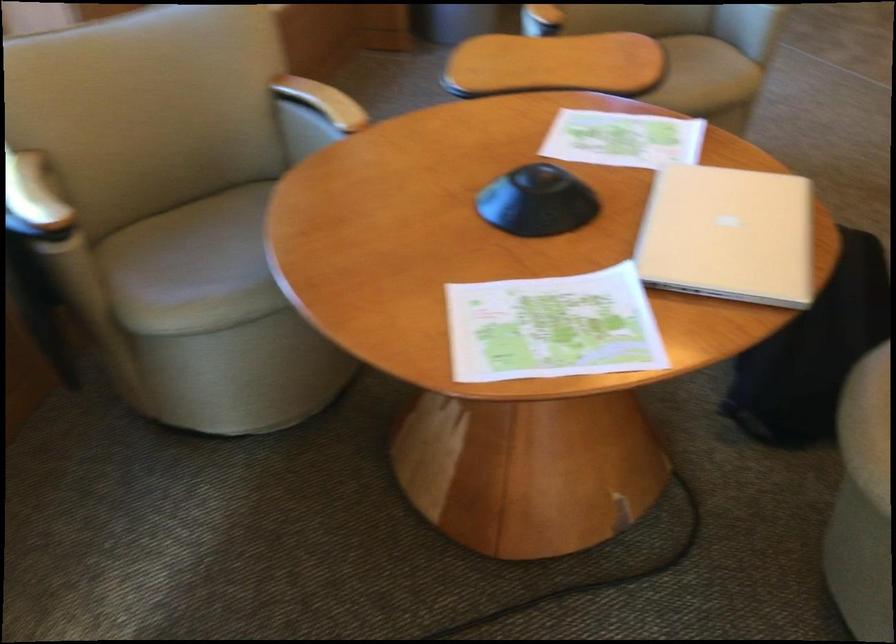
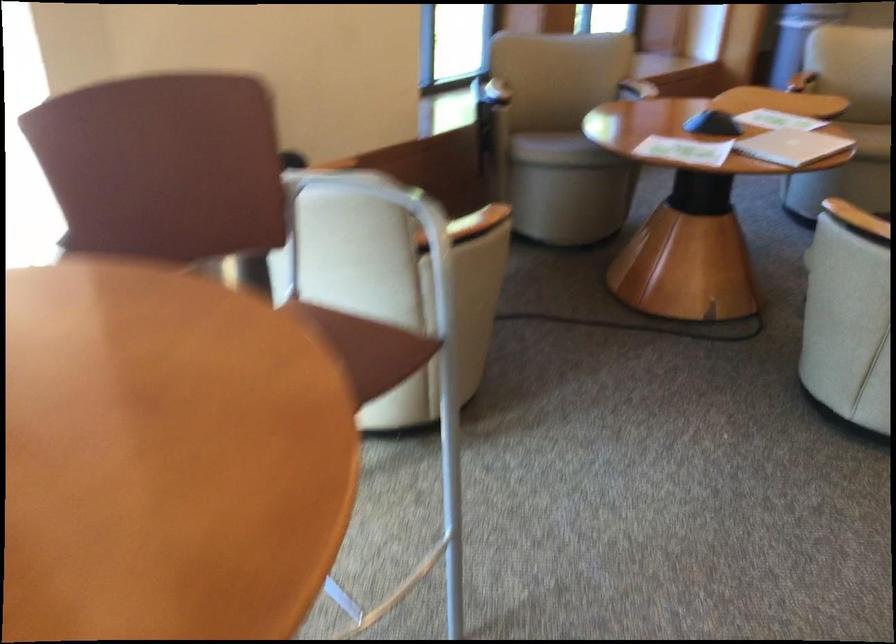
Question: I am providing you with two images of the same scene from different viewpoints. Please identify which objects are invisible in image2.

Choices:
 (A) wooden chair armrest
 (B) beige chair sitting surface
 (C) grey fabric backpack
 (D) closed silver laptop

Answer: (A)